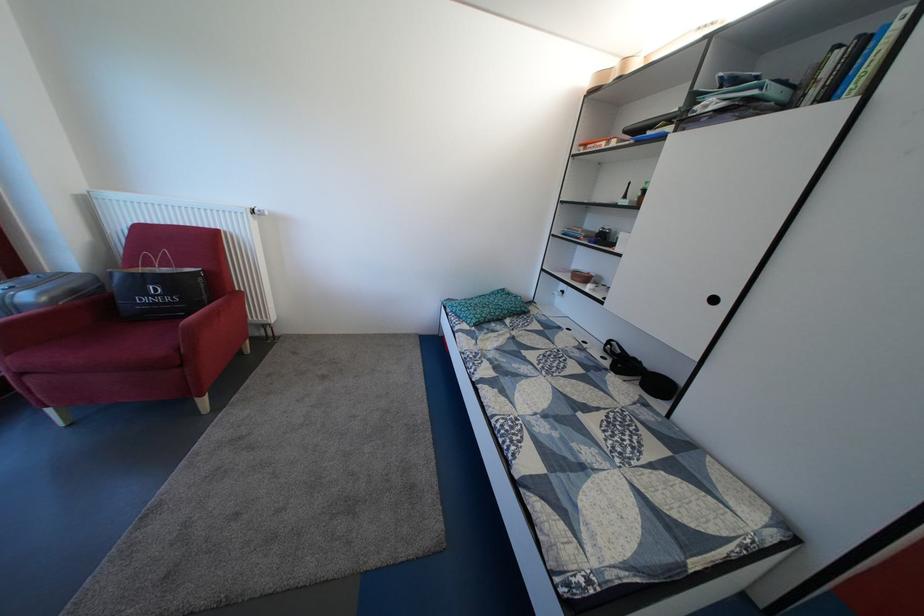
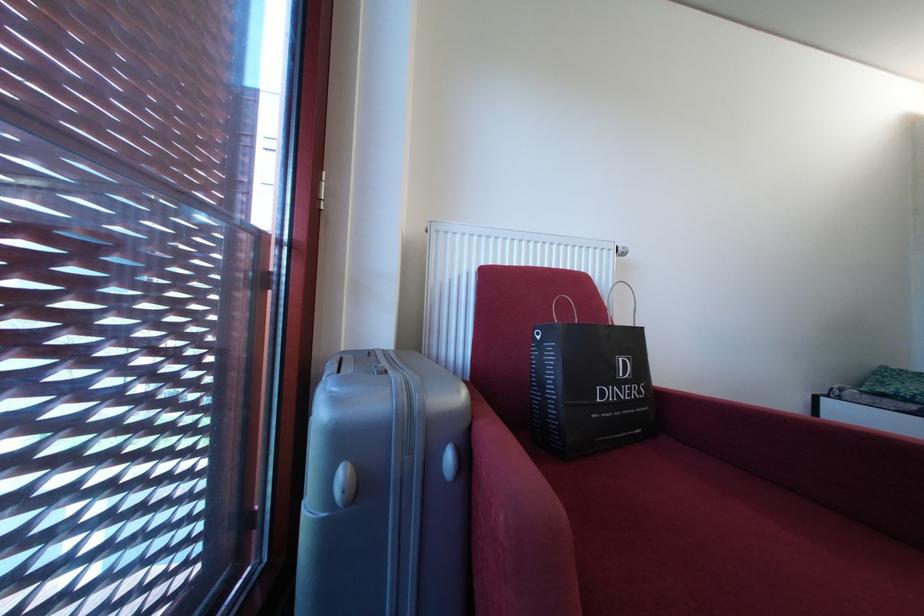
In a continuous first-person perspective shot, in which direction is the camera moving?

The cameraman moved toward left, forward.